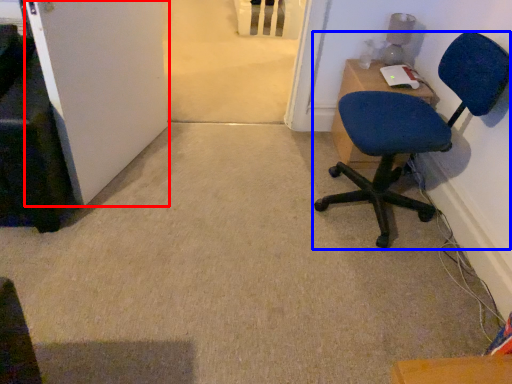
Question: Which point is further to the camera, door (highlighted by a red box) or chair (highlighted by a blue box)?

Choices:
 (A) door
 (B) chair

Answer: (B)